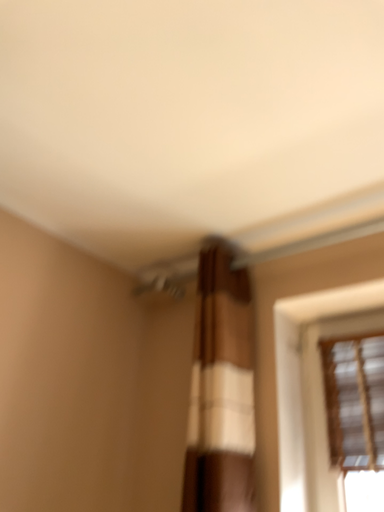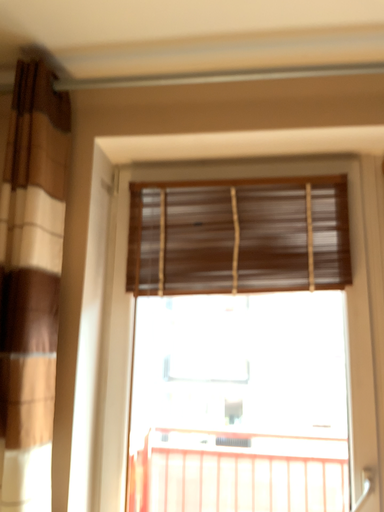
Question: How did the camera likely rotate when shooting the video?

Choices:
 (A) rotated upward
 (B) rotated downward

Answer: (B)